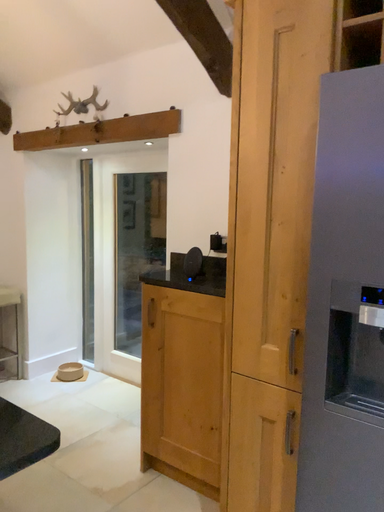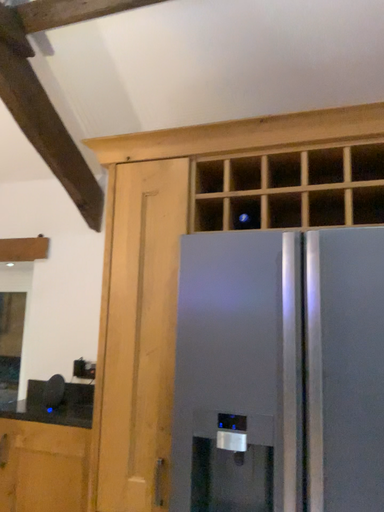
Question: Which way did the camera rotate in the video?

Choices:
 (A) rotated right
 (B) rotated left

Answer: (A)